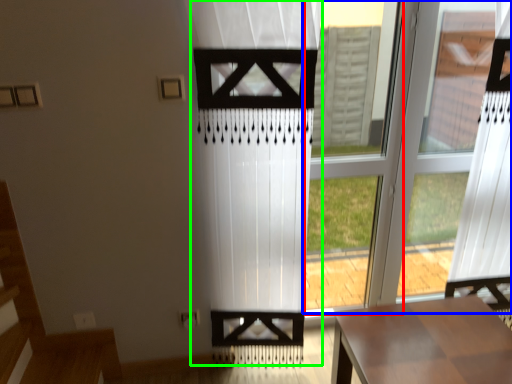
Question: Which is farther away from window frame (highlighted by a red box)? window (highlighted by a blue box) or curtain (highlighted by a green box)?

Choices:
 (A) window
 (B) curtain

Answer: (B)